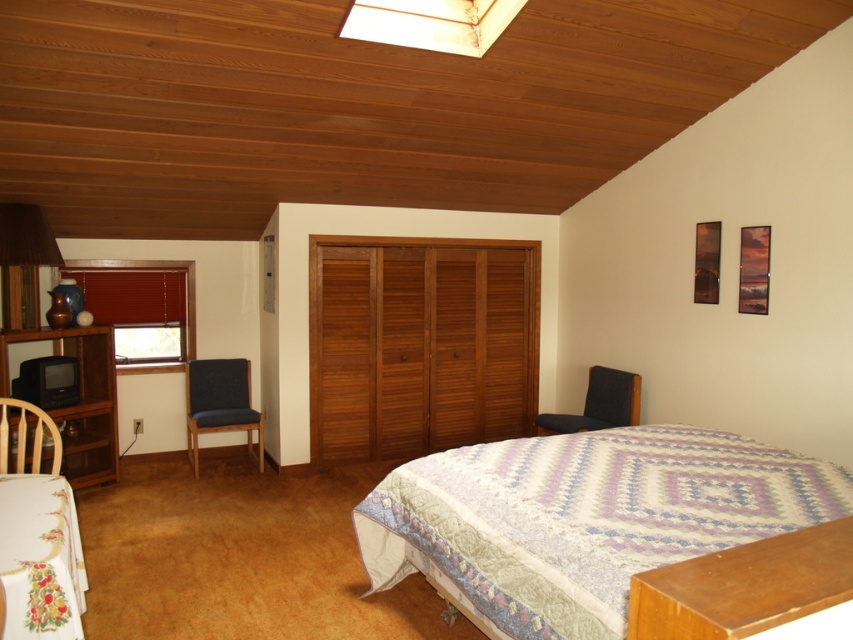
You are planning to place a new rectangular rug in the bedroom. The rug must be wider than the dark blue fabric chair at lower left but narrower than the matte wood lampshade at upper center. Can you confirm if the rug will fit between these two objects?

The matte wood lampshade at upper center is wider than the dark blue fabric chair at lower left. If the rug is wider than the dark blue fabric chair at lower left but narrower than the matte wood lampshade at upper center, it will fit between them as long as its width is within that range.

You are standing in the center of the bedroom and want to move towards the black wood dresser at left. Which direction should you move in?

Since the black wood dresser at left is located at point (79, 397), you should move to the left to reach it.